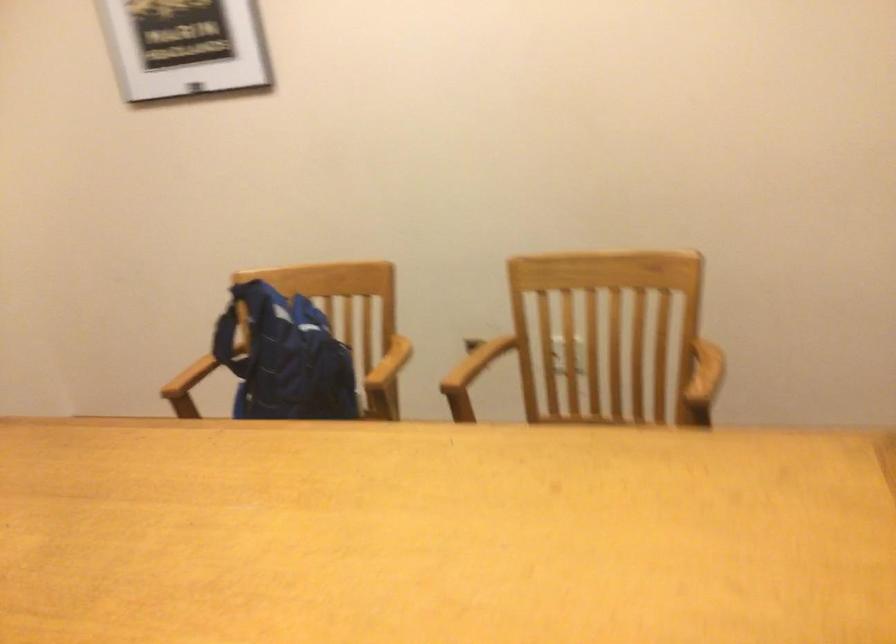
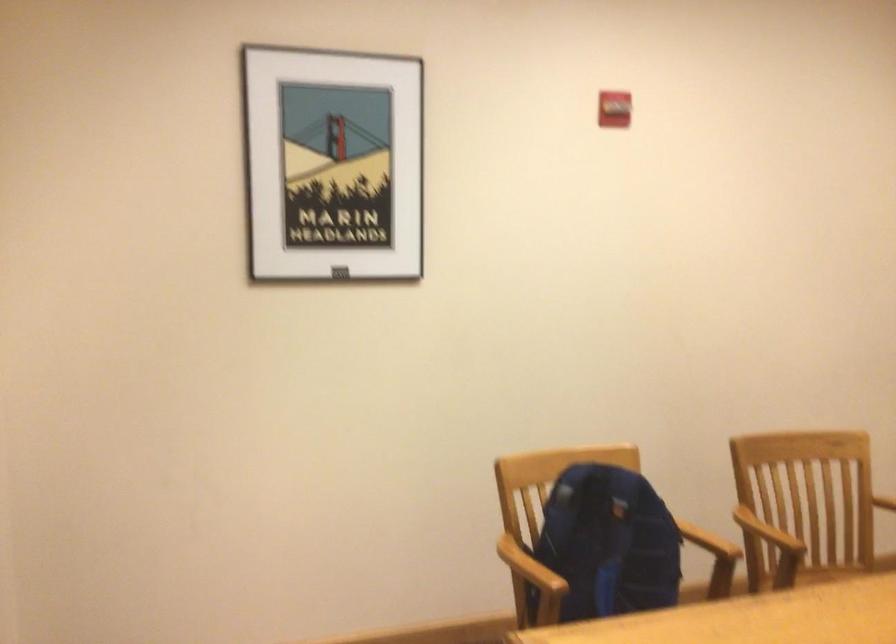
Where in the second image is the point corresponding to (x=273, y=355) from the first image?

(607, 544)